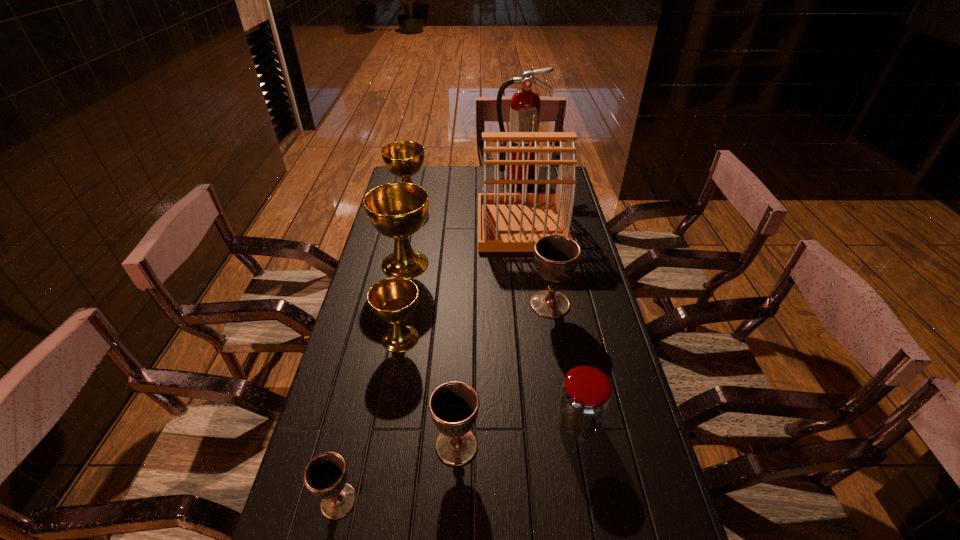
Locate an element on the screen. birdcage present at the right edge is located at coordinates (507, 222).

Where is `chalice located in the right edge section of the desktop`? This screenshot has height=540, width=960. chalice located in the right edge section of the desktop is located at coordinates (556, 257).

This screenshot has height=540, width=960. I want to click on jar that is at the right edge, so click(585, 396).

The height and width of the screenshot is (540, 960). Identify the location of object present at the far left corner. (404, 159).

The height and width of the screenshot is (540, 960). I want to click on object that is positioned at the far right corner, so pyautogui.click(x=525, y=103).

Where is `vacant space at the left edge of the desktop`? Image resolution: width=960 pixels, height=540 pixels. vacant space at the left edge of the desktop is located at coordinates (417, 243).

In order to click on free space at the right edge of the desktop in this screenshot , I will do `click(564, 355)`.

Identify the location of vacant space at the far right corner. (554, 170).

Identify the location of free spot between the beige birdcage and the nearest object. The width and height of the screenshot is (960, 540). (430, 363).

At what (x,y) coordinates should I click in order to perform the action: click on vacant area that lies between the leftmost brown chalice and the sixth farthest object. Please return your answer as a coordinate pair (x, y). The width and height of the screenshot is (960, 540). Looking at the image, I should click on (370, 420).